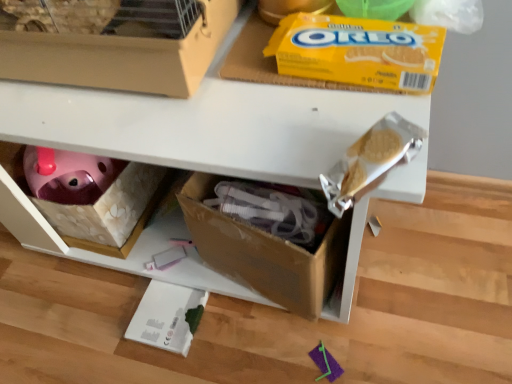
The height and width of the screenshot is (384, 512). Find the location of `free space above cardboard box at lower center (from a real-world perspective)`. free space above cardboard box at lower center (from a real-world perspective) is located at coordinates click(204, 76).